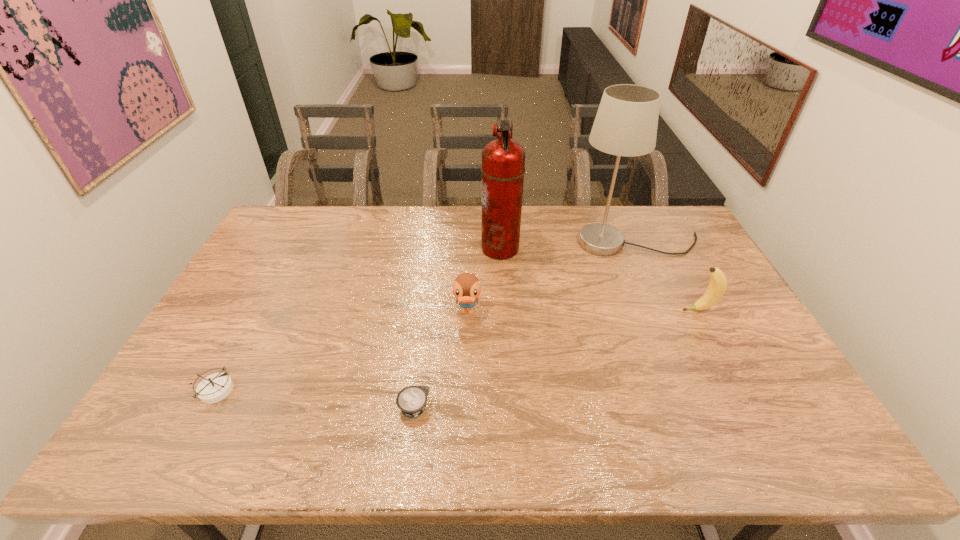
Locate an element on the screen. fire extinguisher located in the far edge section of the desktop is located at coordinates (503, 160).

Find the location of a particular element. The image size is (960, 540). object that is at the near edge is located at coordinates (411, 400).

Identify the location of object located at the left edge. The width and height of the screenshot is (960, 540). (214, 388).

Locate an element on the screen. table lamp that is at the right edge is located at coordinates [x=626, y=122].

Locate an element on the screen. This screenshot has width=960, height=540. banana that is at the right edge is located at coordinates (718, 283).

At what (x,y) coordinates should I click in order to perform the action: click on object that is at the far right corner. Please return your answer as a coordinate pair (x, y). This screenshot has width=960, height=540. Looking at the image, I should click on (626, 122).

Locate an element on the screen. This screenshot has width=960, height=540. vacant space at the far edge of the desktop is located at coordinates (595, 206).

The height and width of the screenshot is (540, 960). Find the location of `free space at the near edge`. free space at the near edge is located at coordinates (497, 440).

In order to click on vacant space at the right edge in this screenshot , I will do `click(689, 299)`.

In the image, there is a desktop. At what (x,y) coordinates should I click in order to perform the action: click on vacant space at the near left corner. Please return your answer as a coordinate pair (x, y). The image size is (960, 540). Looking at the image, I should click on (149, 426).